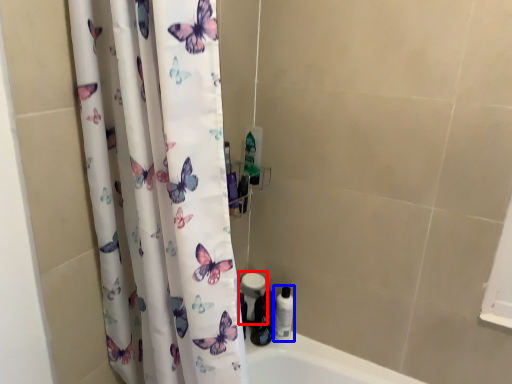
Question: Among these objects, which one is farthest to the camera, toilet paper (highlighted by a red box) or toiletry (highlighted by a blue box)?

Choices:
 (A) toilet paper
 (B) toiletry

Answer: (A)